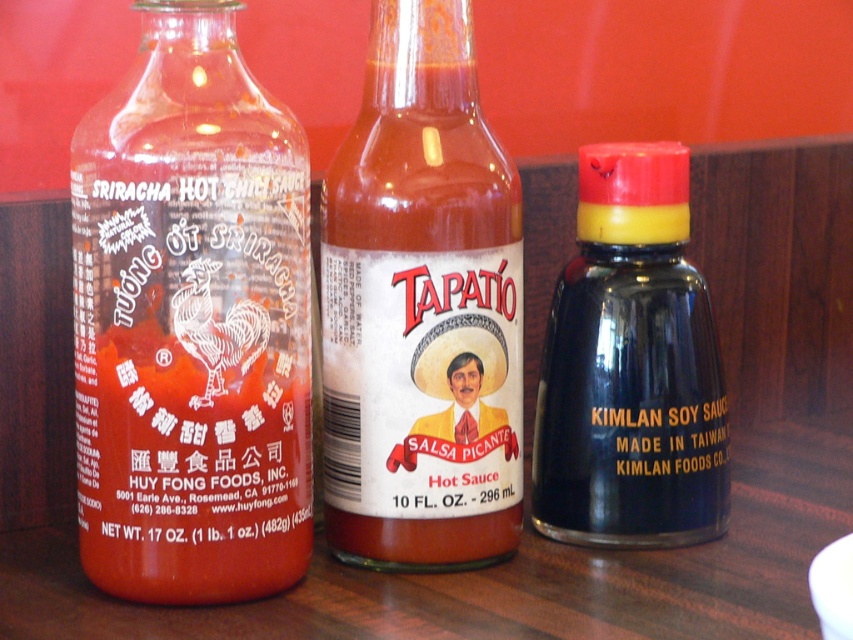
Can you confirm if matte glass bottle at center is wider than black matte soy sauce at center?

No.

Is matte glass bottle at center to the right of black matte soy sauce at center from the viewer's perspective?

In fact, matte glass bottle at center is to the left of black matte soy sauce at center.

Describe the element at coordinates (421, 305) in the screenshot. I see `matte glass bottle at center` at that location.

Locate an element on the screen. The height and width of the screenshot is (640, 853). matte glass bottle at center is located at coordinates (421, 305).

How much distance is there between translucent glass sriracha hot chili sauce bottle at left and matte glass bottle at center?

translucent glass sriracha hot chili sauce bottle at left and matte glass bottle at center are 4.23 inches apart from each other.

Which is behind, point (252, 218) or point (389, 424)?

Positioned behind is point (389, 424).

Measure the distance between translucent glass sriracha hot chili sauce bottle at left and camera.

translucent glass sriracha hot chili sauce bottle at left is 24.77 inches from camera.

The image size is (853, 640). In order to click on translucent glass sriracha hot chili sauce bottle at left in this screenshot , I will do `click(190, 323)`.

Is point (161, 209) less distant than point (631, 410)?

Yes, it is.

This screenshot has width=853, height=640. What do you see at coordinates (190, 323) in the screenshot? I see `translucent glass sriracha hot chili sauce bottle at left` at bounding box center [190, 323].

Find the location of a particular element. This screenshot has width=853, height=640. translucent glass sriracha hot chili sauce bottle at left is located at coordinates (190, 323).